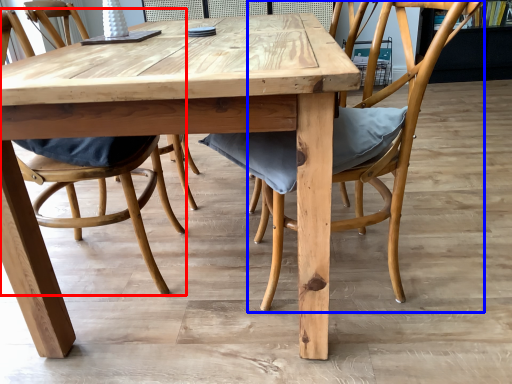
Question: Which object is further to the camera taking this photo, chair (highlighted by a red box) or chair (highlighted by a blue box)?

Choices:
 (A) chair
 (B) chair

Answer: (A)